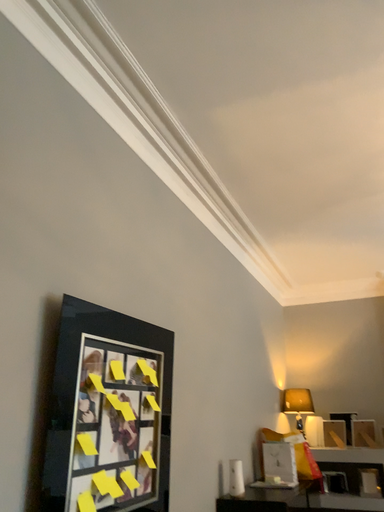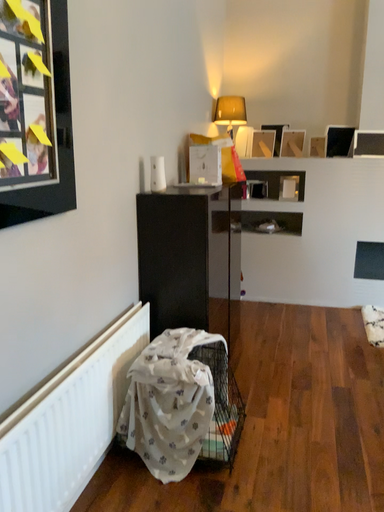
Question: How did the camera likely rotate when shooting the video?

Choices:
 (A) rotated left
 (B) rotated right

Answer: (B)